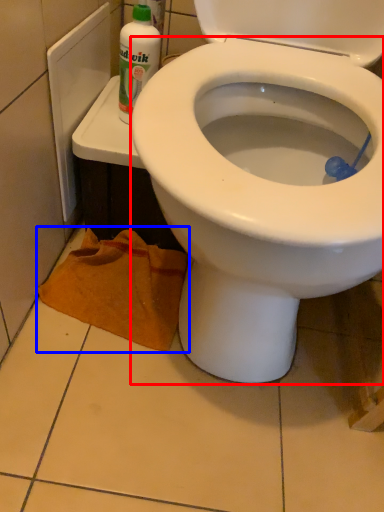
Question: Which object is further to the camera taking this photo, bidet (highlighted by a red box) or material (highlighted by a blue box)?

Choices:
 (A) bidet
 (B) material

Answer: (B)